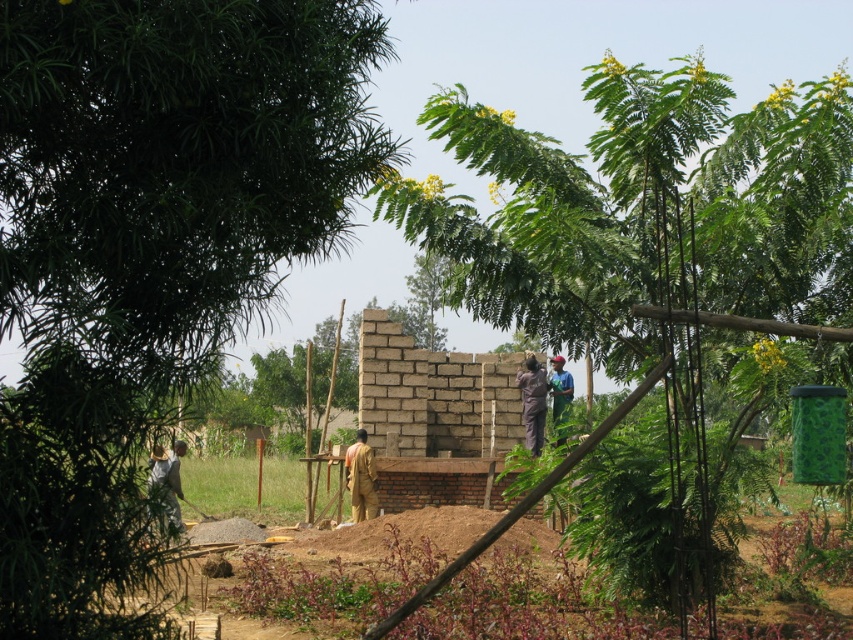
Which of these two, green leafy tree at upper left or brown fabric construction worker at center, stands shorter?

brown fabric construction worker at center

Describe the element at coordinates (149, 248) in the screenshot. I see `green leafy tree at upper left` at that location.

Who is more distant from viewer, (4,26) or (370,484)?

The point (370,484) is more distant.

Locate an element on the screen. The width and height of the screenshot is (853, 640). green leafy tree at upper left is located at coordinates (149, 248).

Does green leafy tree at center come in front of brown fabric construction worker at center?

Yes, it is.

Locate an element on the screen. This screenshot has height=640, width=853. green leafy tree at center is located at coordinates (659, 241).

From the picture: Is light brown fabric shirt at lower left to the left of brown fabric at center from the viewer's perspective?

Indeed, light brown fabric shirt at lower left is positioned on the left side of brown fabric at center.

From the picture: Is light brown fabric shirt at lower left taller than brown fabric at center?

Yes, light brown fabric shirt at lower left is taller than brown fabric at center.

I want to click on light brown fabric shirt at lower left, so click(x=167, y=481).